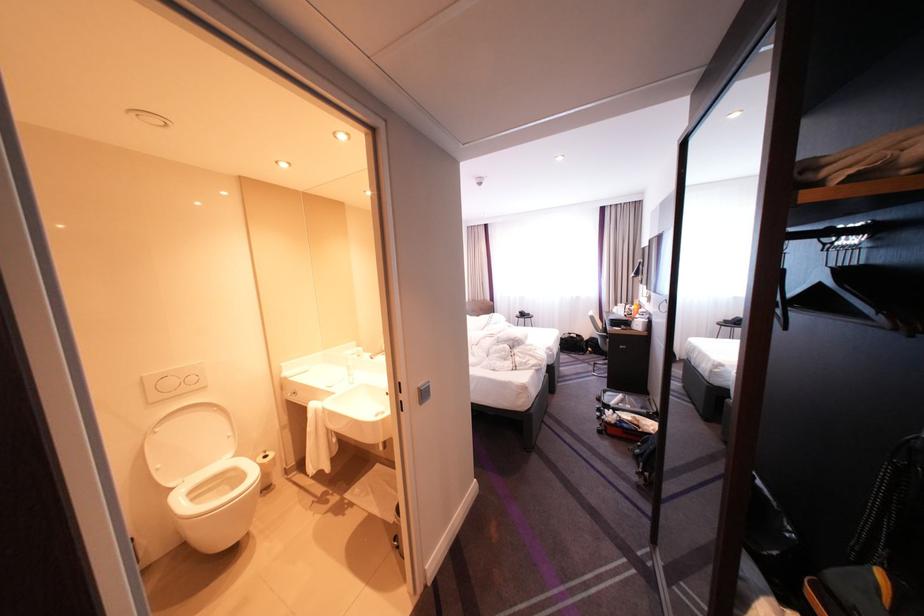
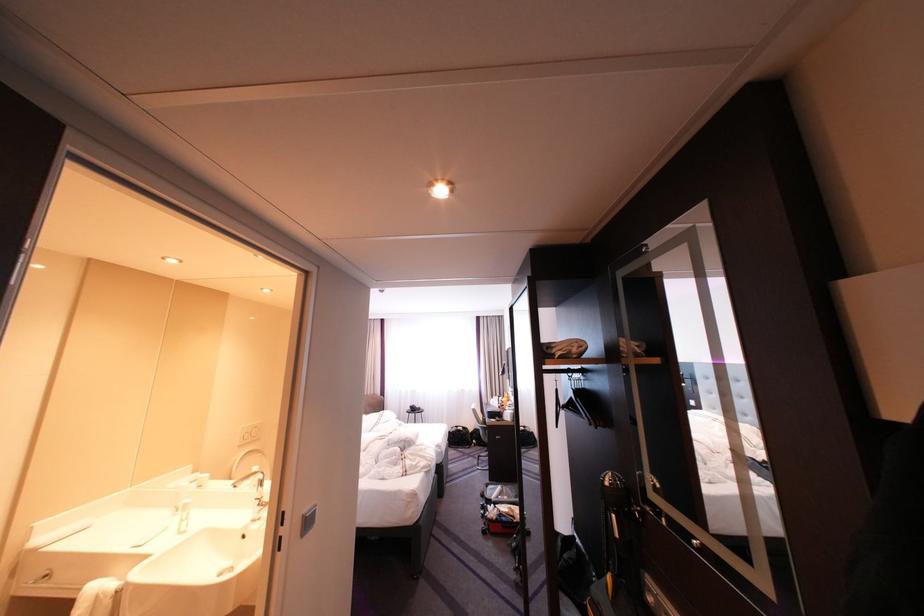
Locate, in the second image, the point that corresponds to the point at 430,389 in the first image.

(314, 516)